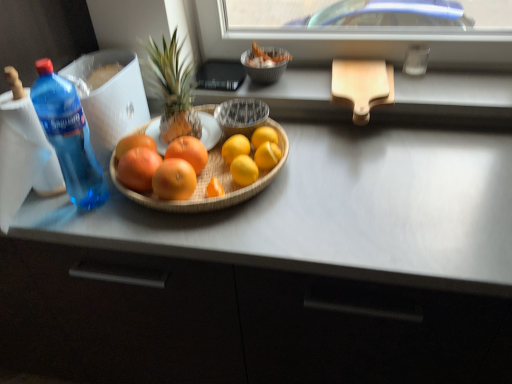
Find the location of a particular element. This screenshot has height=384, width=512. space that is in front of orange matte grapefruit at center, arranged as the 3th grapefruit when viewed from the left is located at coordinates (181, 229).